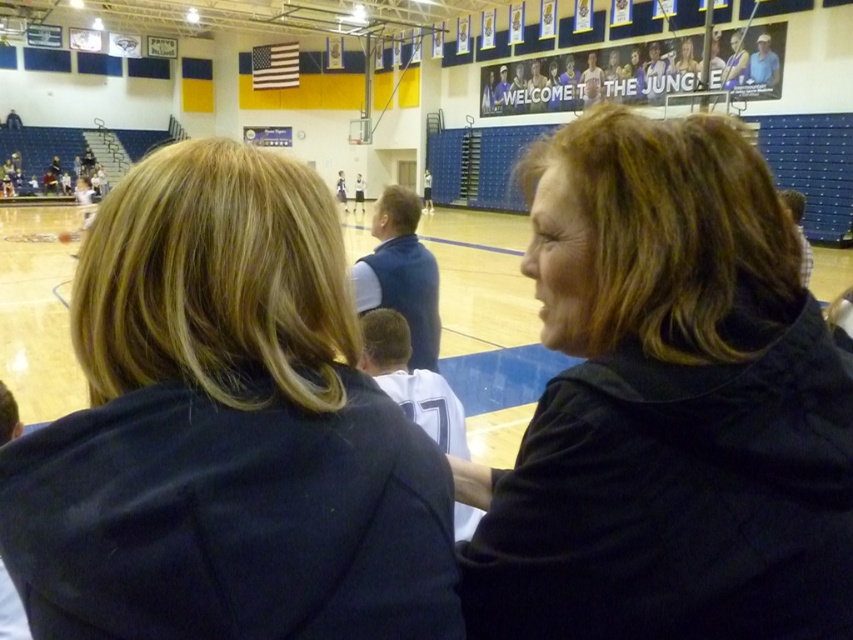
Is point (608, 465) behind point (563, 93)?

No, it is in front of (563, 93).

Is point (839, 468) more distant than point (677, 60)?

No, (839, 468) is closer to viewer.

The image size is (853, 640). Identify the location of black matte jacket at center. (666, 404).

Is point (173, 221) behind point (750, 326)?

No.

Which is more to the right, dark blue jacket at upper left or black matte jacket at center?

From the viewer's perspective, black matte jacket at center appears more on the right side.

Is point (318, 566) closer to camera compared to point (604, 148)?

Yes.

Locate an element on the screen. This screenshot has height=640, width=853. dark blue jacket at upper left is located at coordinates (225, 429).

Is point (364, 500) less distant than point (769, 48)?

Yes, it is in front of point (769, 48).

Is dark blue jacket at upper left further to camera compared to blue jersey at upper center?

No, it is in front of blue jersey at upper center.

Where is `dark blue jacket at upper left`? dark blue jacket at upper left is located at coordinates (225, 429).

At what (x,y) coordinates should I click in order to perform the action: click on dark blue jacket at upper left. Please return your answer as a coordinate pair (x, y). This screenshot has width=853, height=640. Looking at the image, I should click on (225, 429).